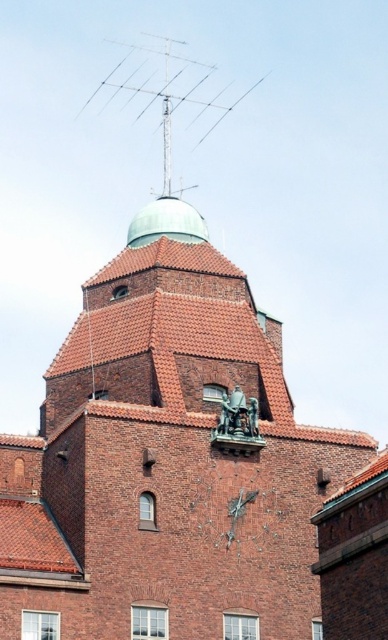
Question: Among these objects, which one is nearest to the camera?

Choices:
 (A) metallic antenna at upper center
 (B) brown tiled roof at lower left

Answer: (B)

Question: Can you confirm if brown tiled roof at lower left is positioned above metallic antenna at upper center?

Choices:
 (A) no
 (B) yes

Answer: (A)

Question: Is brown tiled roof at lower left to the right of metallic antenna at upper center from the viewer's perspective?

Choices:
 (A) yes
 (B) no

Answer: (B)

Question: Does brown tiled roof at lower left have a larger size compared to metallic antenna at upper center?

Choices:
 (A) no
 (B) yes

Answer: (A)

Question: Which object appears farthest from the camera in this image?

Choices:
 (A) brown tiled roof at lower left
 (B) metallic antenna at upper center

Answer: (B)